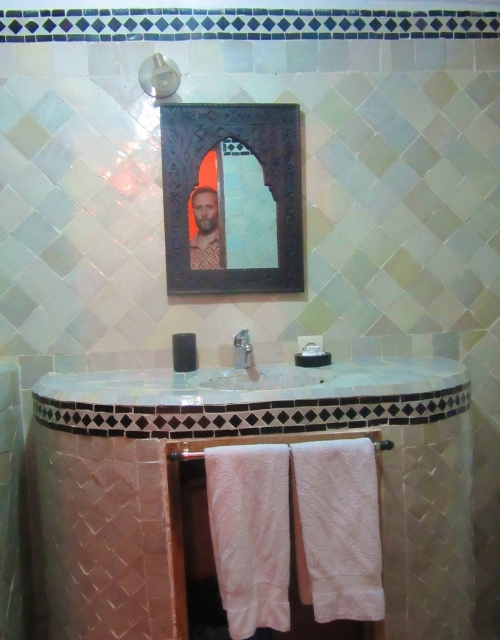
Question: Which of the following is the closest to the observer?

Choices:
 (A) white glossy sink at center
 (B) metallic silver shower head at upper center
 (C) dark wood mirror at upper center

Answer: (A)

Question: Among these points, which one is farthest from the camera?

Choices:
 (A) (269, 365)
 (B) (188, 449)
 (C) (242, 356)
 (D) (209, 228)

Answer: (A)

Question: Is dark wood mirror at upper center in front of wooden towel bar at center?

Choices:
 (A) no
 (B) yes

Answer: (A)

Question: Can you confirm if white glossy sink at center is smaller than patterned fabric man at center?

Choices:
 (A) yes
 (B) no

Answer: (B)

Question: Observing the image, what is the correct spatial positioning of white glossy sink at center in reference to metallic silver shower head at upper center?

Choices:
 (A) below
 (B) above

Answer: (A)

Question: Which object appears farthest from the camera in this image?

Choices:
 (A) dark wood mirror at upper center
 (B) metallic silver shower head at upper center
 (C) patterned fabric man at center
 (D) wooden towel bar at center

Answer: (C)